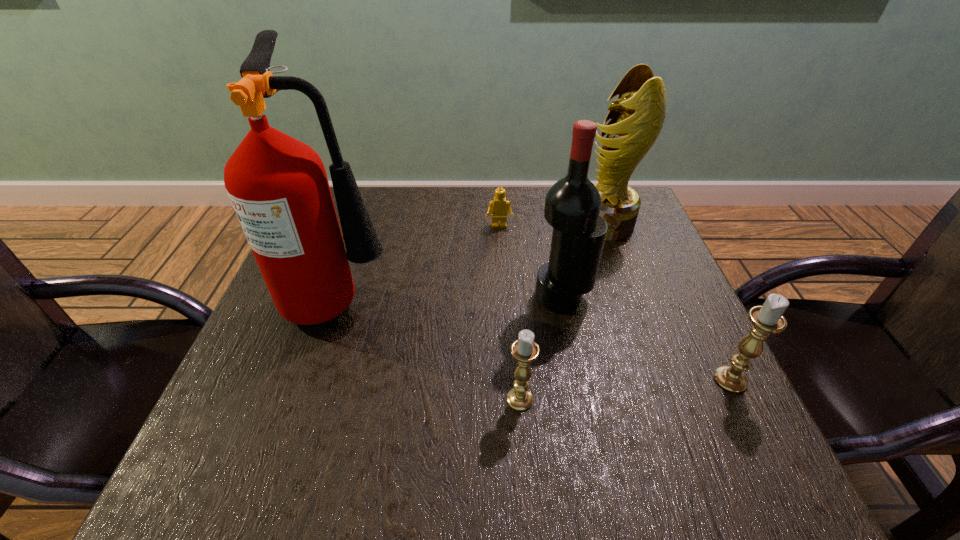
Find the location of `candle holder present at the right edge`. candle holder present at the right edge is located at coordinates (766, 319).

Where is `award that is at the right edge`? The width and height of the screenshot is (960, 540). award that is at the right edge is located at coordinates pyautogui.click(x=637, y=116).

Locate an element on the screen. The height and width of the screenshot is (540, 960). object that is positioned at the far right corner is located at coordinates (637, 116).

I want to click on object located in the near right corner section of the desktop, so click(x=766, y=319).

The height and width of the screenshot is (540, 960). I want to click on vacant area at the far edge, so click(431, 201).

Where is `free region at the near edge of the desktop`? free region at the near edge of the desktop is located at coordinates (649, 426).

In the image, there is a desktop. Identify the location of vacant region at the left edge. This screenshot has height=540, width=960. (289, 323).

Identify the location of vacant space at the right edge. (662, 259).

The height and width of the screenshot is (540, 960). I want to click on free region at the far left corner of the desktop, so click(x=382, y=191).

Locate an element on the screen. vacant space in between the left candle holder and the fire extinguisher is located at coordinates (430, 348).